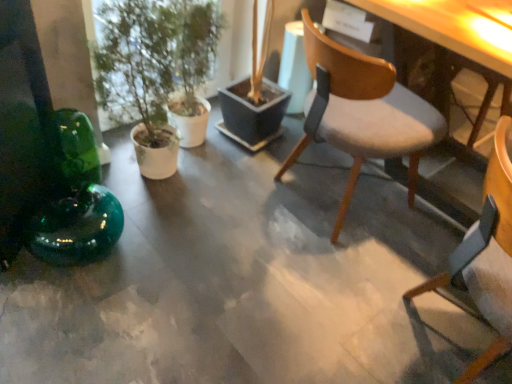
Locate an element on the screen. light gray fabric chair at center, the first chair in the back-to-front sequence is located at coordinates (362, 112).

Identify the location of light gray fabric chair at center, the first chair in the back-to-front sequence. The image size is (512, 384). (362, 112).

In the scene shown: Does green matte plant at left have a lesser width compared to light gray fabric chair at center, the first chair in the back-to-front sequence?

Indeed, green matte plant at left has a lesser width compared to light gray fabric chair at center, the first chair in the back-to-front sequence.

Is green matte plant at left not close to light gray fabric chair at center, the first chair in the back-to-front sequence?

That's not correct — green matte plant at left is a little close to light gray fabric chair at center, the first chair in the back-to-front sequence.

From a real-world perspective, is green matte plant at left physically above light gray fabric chair at center, the first chair in the back-to-front sequence?

Yes, from a real-world perspective, green matte plant at left is on top of light gray fabric chair at center, the first chair in the back-to-front sequence.

Does green matte plant at left turn towards light gray fabric chair at center, the first chair in the back-to-front sequence?

No, green matte plant at left is not oriented towards light gray fabric chair at center, the first chair in the back-to-front sequence.

Which is more to the right, wooden chair at center, which is the second chair in back-to-front order, or light gray fabric chair at center, the first chair in the back-to-front sequence?

Positioned to the right is wooden chair at center, which is the second chair in back-to-front order.

Do you think wooden chair at center, which is the second chair in back-to-front order, is within light gray fabric chair at center, the first chair in the back-to-front sequence, or outside of it?

wooden chair at center, which is the second chair in back-to-front order, cannot be found inside light gray fabric chair at center, the first chair in the back-to-front sequence.

From the image's perspective, is wooden chair at center, the first chair when ordered from front to back, positioned above or below light gray fabric chair at center, the first chair in the back-to-front sequence?

wooden chair at center, the first chair when ordered from front to back, is below light gray fabric chair at center, the first chair in the back-to-front sequence.

Image resolution: width=512 pixels, height=384 pixels. Identify the location of chair in front of the light gray fabric chair at center, the first chair in the back-to-front sequence. (486, 257).

Considering the points (470, 236) and (141, 107), which point is behind, point (470, 236) or point (141, 107)?

The point (141, 107) is behind.

Is wooden chair at center, which is the second chair in back-to-front order, located outside green matte plant at left?

Yes, wooden chair at center, which is the second chair in back-to-front order, is outside of green matte plant at left.

Considering the relative sizes of wooden chair at center, the first chair when ordered from front to back, and green matte plant at left in the image provided, is wooden chair at center, the first chair when ordered from front to back, smaller than green matte plant at left?

No, wooden chair at center, the first chair when ordered from front to back, is not smaller than green matte plant at left.

Is wooden chair at center, the first chair when ordered from front to back, further to camera compared to green matte plant at left?

No, it is not.

From a real-world perspective, is green matte plant at left physically located above or below wooden chair at center, which is the second chair in back-to-front order?

green matte plant at left is situated higher than wooden chair at center, which is the second chair in back-to-front order, in the real world.

Is green matte plant at left touching wooden chair at center, which is the second chair in back-to-front order?

No, green matte plant at left is not with wooden chair at center, which is the second chair in back-to-front order.

Can you tell me how much green matte plant at left and wooden chair at center, which is the second chair in back-to-front order, differ in facing direction?

51.9 degrees.

Between light gray fabric chair at center, which is the 2th chair from front to back, and wooden chair at center, the first chair when ordered from front to back, which one has less height?

light gray fabric chair at center, which is the 2th chair from front to back, is shorter.

From the image's perspective, is light gray fabric chair at center, which is the 2th chair from front to back, above wooden chair at center, which is the second chair in back-to-front order?

Yes, from the image's perspective, light gray fabric chair at center, which is the 2th chair from front to back, is over wooden chair at center, which is the second chair in back-to-front order.

In the scene shown: Does light gray fabric chair at center, which is the 2th chair from front to back, contain wooden chair at center, the first chair when ordered from front to back?

No, wooden chair at center, the first chair when ordered from front to back, is not surrounded by light gray fabric chair at center, which is the 2th chair from front to back.

Which point is more distant from viewer, [327,99] or [181,50]?

The point [181,50] is behind.

At what (x,y) coordinates should I click in order to perform the action: click on houseplant that appears on the left of light gray fabric chair at center, which is the 2th chair from front to back. Please return your answer as a coordinate pair (x, y). Looking at the image, I should click on (154, 56).

From the image's perspective, is light gray fabric chair at center, the first chair in the back-to-front sequence, under green matte plant at left?

Correct, light gray fabric chair at center, the first chair in the back-to-front sequence, appears lower than green matte plant at left in the image.

In terms of height, does light gray fabric chair at center, the first chair in the back-to-front sequence, look taller or shorter compared to green matte plant at left?

Considering their sizes, light gray fabric chair at center, the first chair in the back-to-front sequence, has less height than green matte plant at left.

The width and height of the screenshot is (512, 384). I want to click on the 1st chair below the green matte plant at left (from the image's perspective), so click(362, 112).

You are a GUI agent. You are given a task and a screenshot of the screen. Output one action in this format:
    pyautogui.click(x=<x>, y=<y>)
    Task: Click on the chair behind the wooden chair at center, which is the second chair in back-to-front order
    This screenshot has height=384, width=512.
    Given the screenshot: What is the action you would take?
    pyautogui.click(x=362, y=112)

Considering their positions, is green matte plant at left positioned closer to light gray fabric chair at center, which is the 2th chair from front to back, than wooden chair at center, the first chair when ordered from front to back?

wooden chair at center, the first chair when ordered from front to back, is positioned closer to the anchor light gray fabric chair at center, which is the 2th chair from front to back.

Considering their positions, is green matte plant at left positioned further to wooden chair at center, the first chair when ordered from front to back, than light gray fabric chair at center, the first chair in the back-to-front sequence?

Among the two, green matte plant at left is located further to wooden chair at center, the first chair when ordered from front to back.

Considering their positions, is light gray fabric chair at center, the first chair in the back-to-front sequence, positioned closer to green matte plant at left than wooden chair at center, which is the second chair in back-to-front order?

light gray fabric chair at center, the first chair in the back-to-front sequence.

Based on their spatial positions, is light gray fabric chair at center, which is the 2th chair from front to back, or green matte plant at left closer to wooden chair at center, which is the second chair in back-to-front order?

light gray fabric chair at center, which is the 2th chair from front to back, is positioned closer to the anchor wooden chair at center, which is the second chair in back-to-front order.

When comparing their distances from green matte plant at left, does wooden chair at center, which is the second chair in back-to-front order, or light gray fabric chair at center, which is the 2th chair from front to back, seem further?

wooden chair at center, which is the second chair in back-to-front order, is positioned further to the anchor green matte plant at left.

From the image, which object appears to be nearer to light gray fabric chair at center, which is the 2th chair from front to back, wooden chair at center, the first chair when ordered from front to back, or green matte plant at left?

The object closer to light gray fabric chair at center, which is the 2th chair from front to back, is wooden chair at center, the first chair when ordered from front to back.

Where is `chair situated between green matte plant at left and wooden chair at center, the first chair when ordered from front to back, from left to right`? The image size is (512, 384). chair situated between green matte plant at left and wooden chair at center, the first chair when ordered from front to back, from left to right is located at coordinates (362, 112).